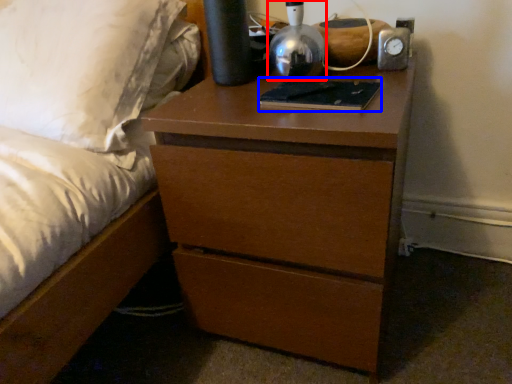
Question: Which object is further to the camera taking this photo, bedside lamp (highlighted by a red box) or book (highlighted by a blue box)?

Choices:
 (A) bedside lamp
 (B) book

Answer: (B)